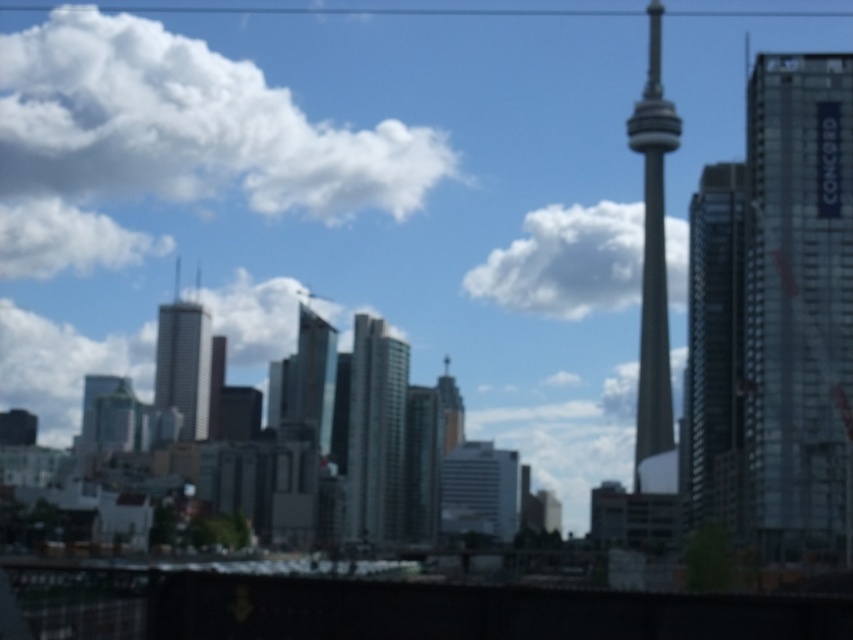
Is glassy reflective skyscraper at right shorter than silver glass skyscraper at center?

No, glassy reflective skyscraper at right is not shorter than silver glass skyscraper at center.

Which is behind, point (728, 496) or point (206, 429)?

The point (206, 429) is behind.

The height and width of the screenshot is (640, 853). What do you see at coordinates (715, 353) in the screenshot? I see `glassy reflective skyscraper at right` at bounding box center [715, 353].

Find the location of a particular element. glassy reflective skyscraper at right is located at coordinates (715, 353).

Does white fluffy cloud at upper center appear under silver glass skyscraper at center?

No.

Between white fluffy cloud at upper center and silver glass skyscraper at center, which one appears on the right side from the viewer's perspective?

white fluffy cloud at upper center

Where is `white fluffy cloud at upper center`? This screenshot has width=853, height=640. white fluffy cloud at upper center is located at coordinates (566, 260).

Locate an element on the screen. The height and width of the screenshot is (640, 853). white fluffy cloud at upper center is located at coordinates (566, 260).

Is smooth glass cn tower at center smaller than smooth glass skyscraper at center?

No, smooth glass cn tower at center is not smaller than smooth glass skyscraper at center.

Which is behind, point (639, 147) or point (453, 392)?

Positioned behind is point (453, 392).

Who is more distant from viewer, [663,257] or [454,385]?

The point [454,385] is more distant.

This screenshot has height=640, width=853. Identify the location of smooth glass cn tower at center. (653, 253).